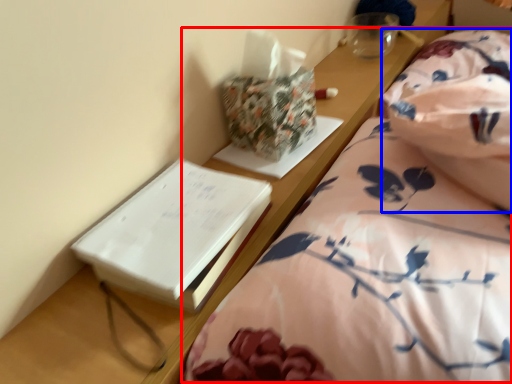
Question: Which of the following is the closest to the observer, bed (highlighted by a red box) or blanket (highlighted by a blue box)?

Choices:
 (A) bed
 (B) blanket

Answer: (A)